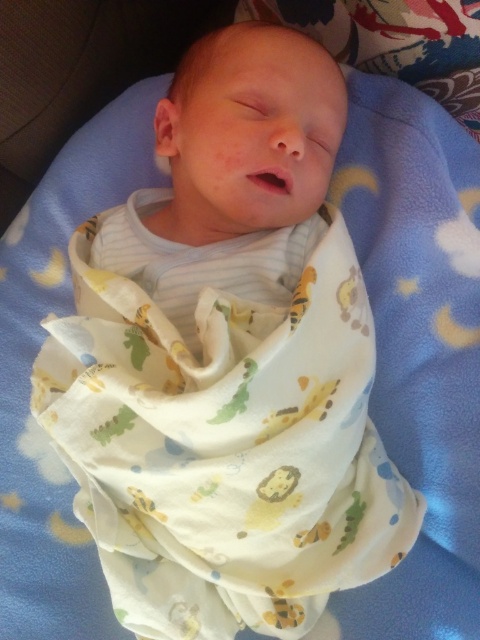
You are a nurse checking on a newborn baby. You notice the white fabric with animal prints at center and the white soft swaddle at center. Which one is taller?

The white fabric with animal prints at center is taller than the white soft swaddle at center.

You are a photographer taking a closeup shot of the newborn baby. You notice the point at coordinate (225, 448). What object is located at that point?

The white fabric with animal prints at center is located at point (225, 448).

You are a new parent trying to swaddle your baby. You have two options available in the image, the white fabric with animal prints at center and the white soft swaddle at center. Which one would you choose if you want to use the larger item for swaddling?

The white fabric with animal prints at center is larger in size than the white soft swaddle at center, so you should choose the white fabric with animal prints at center for swaddling.